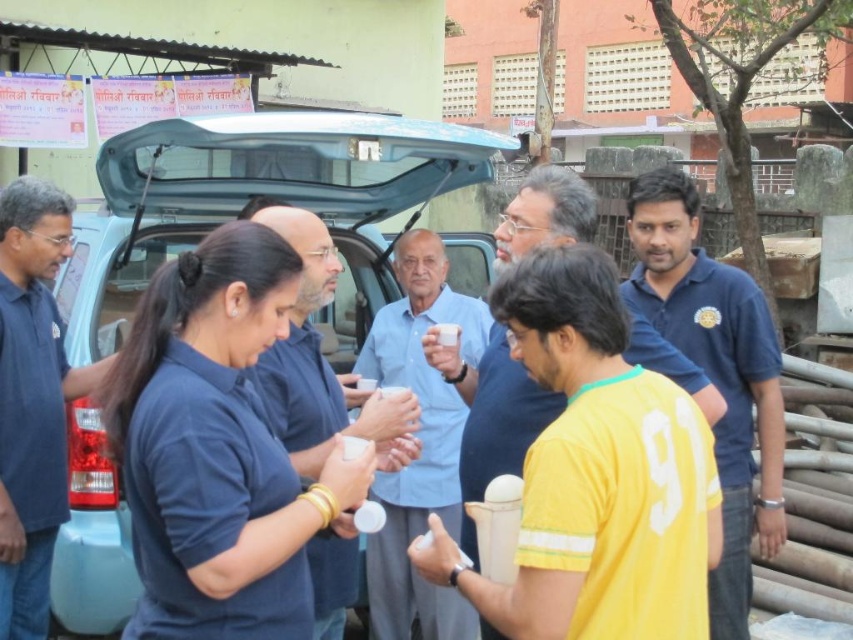
Is blue cotton shirt at right taller than dark blue shirt at left?

No, blue cotton shirt at right is not taller than dark blue shirt at left.

Is point (750, 529) farther from camera compared to point (16, 490)?

Yes.

Which is in front, point (746, 632) or point (33, 477)?

Point (33, 477)

You are a GUI agent. You are given a task and a screenshot of the screen. Output one action in this format:
    pyautogui.click(x=<x>, y=<y>)
    Task: Click on the blue cotton shirt at right
    
    Given the screenshot: What is the action you would take?
    pyautogui.click(x=715, y=371)

Does blue cotton shirt at right appear under light blue shirt at center?

No.

Does point (683, 234) come farther from viewer compared to point (416, 483)?

No, (683, 234) is in front of (416, 483).

Is point (634, 301) positioned after point (444, 499)?

That is False.

Find the location of a particular element. The height and width of the screenshot is (640, 853). blue cotton shirt at right is located at coordinates (715, 371).

Which is behind, point (456, 180) or point (508, 243)?

Positioned behind is point (456, 180).

Does light blue matte car at center have a larger size compared to yellow jersey at center?

Yes.

Is point (90, 545) positioned after point (515, 205)?

Yes, point (90, 545) is farther from viewer.

You are a GUI agent. You are given a task and a screenshot of the screen. Output one action in this format:
    pyautogui.click(x=<x>, y=<y>)
    Task: Click on the light blue matte car at center
    
    Given the screenshot: What is the action you would take?
    pyautogui.click(x=260, y=195)